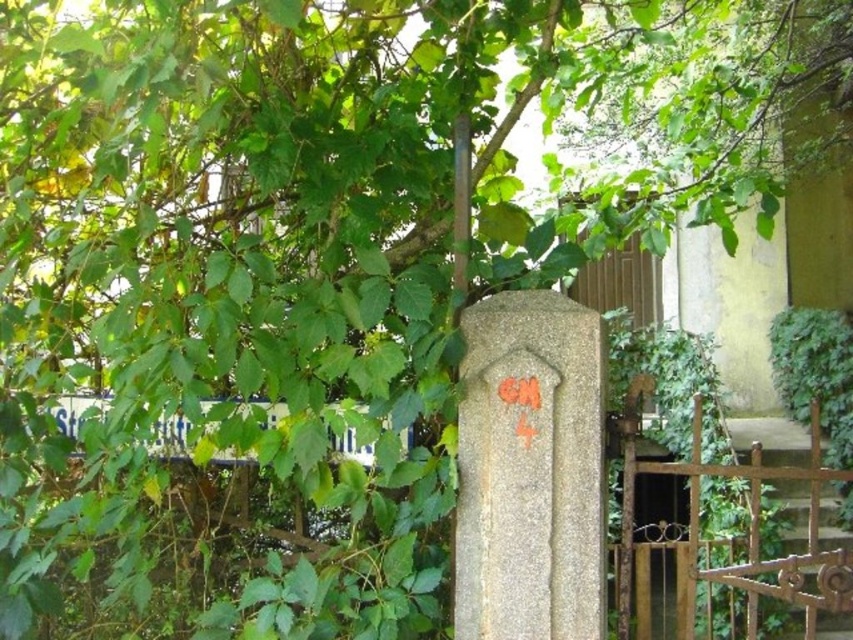
Who is lower down, granite gravestone at center or white plastic street sign at lower left?

granite gravestone at center is lower down.

At what (x,y) coordinates should I click in order to perform the action: click on granite gravestone at center. Please return your answer as a coordinate pair (x, y). The image size is (853, 640). Looking at the image, I should click on click(529, 470).